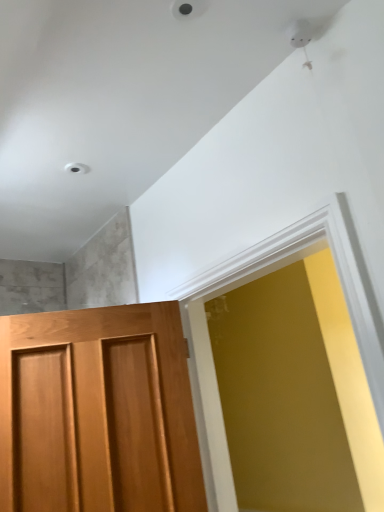
Question: From a real-world perspective, does matte white frame at center stand above wooden door at left?

Choices:
 (A) yes
 (B) no

Answer: (A)

Question: Does matte white frame at center have a larger size compared to wooden door at left?

Choices:
 (A) no
 (B) yes

Answer: (B)

Question: From a real-world perspective, is matte white frame at center located beneath wooden door at left?

Choices:
 (A) no
 (B) yes

Answer: (A)

Question: From the image's perspective, is matte white frame at center located above wooden door at left?

Choices:
 (A) yes
 (B) no

Answer: (A)

Question: Is wooden door at left located within matte white frame at center?

Choices:
 (A) yes
 (B) no

Answer: (B)

Question: Is matte white frame at center at the right side of wooden door at left?

Choices:
 (A) yes
 (B) no

Answer: (A)

Question: Considering the relative positions of wooden door at left and matte white frame at center in the image provided, is wooden door at left to the right of matte white frame at center from the viewer's perspective?

Choices:
 (A) no
 (B) yes

Answer: (A)

Question: From the image's perspective, is wooden door at left located beneath matte white frame at center?

Choices:
 (A) yes
 (B) no

Answer: (A)

Question: Considering the relative sizes of wooden door at left and matte white frame at center in the image provided, is wooden door at left thinner than matte white frame at center?

Choices:
 (A) no
 (B) yes

Answer: (B)

Question: Is wooden door at left smaller than matte white frame at center?

Choices:
 (A) yes
 (B) no

Answer: (A)

Question: From a real-world perspective, is wooden door at left under matte white frame at center?

Choices:
 (A) yes
 (B) no

Answer: (A)

Question: Considering the relative sizes of wooden door at left and matte white frame at center in the image provided, is wooden door at left shorter than matte white frame at center?

Choices:
 (A) yes
 (B) no

Answer: (A)

Question: Is wooden door at left in front of or behind matte white frame at center in the image?

Choices:
 (A) front
 (B) behind

Answer: (B)